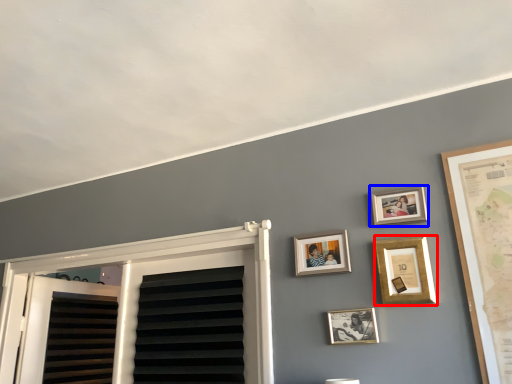
Question: Among these objects, which one is nearest to the camera, picture frame (highlighted by a red box) or picture frame (highlighted by a blue box)?

Choices:
 (A) picture frame
 (B) picture frame

Answer: (A)